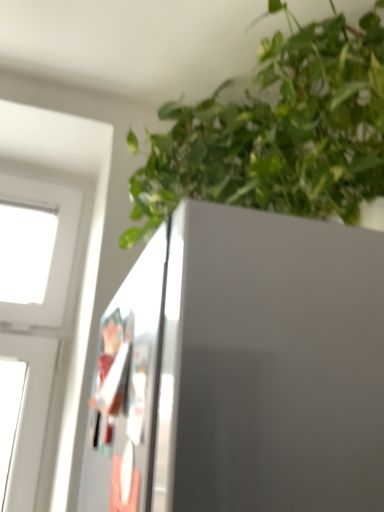
Question: Considering the positions of green leafy plant at upper right and transparent plastic screen door at left in the image, is green leafy plant at upper right bigger or smaller than transparent plastic screen door at left?

Choices:
 (A) small
 (B) big

Answer: (B)

Question: Which is correct: green leafy plant at upper right is inside transparent plastic screen door at left, or outside of it?

Choices:
 (A) inside
 (B) outside

Answer: (B)

Question: Looking at their shapes, would you say green leafy plant at upper right is wider or thinner than transparent plastic screen door at left?

Choices:
 (A) wide
 (B) thin

Answer: (A)

Question: Is transparent plastic screen door at left taller or shorter than green leafy plant at upper right?

Choices:
 (A) short
 (B) tall

Answer: (A)

Question: Would you say transparent plastic screen door at left is to the left or to the right of green leafy plant at upper right in the picture?

Choices:
 (A) right
 (B) left

Answer: (B)

Question: Do you think transparent plastic screen door at left is within green leafy plant at upper right, or outside of it?

Choices:
 (A) outside
 (B) inside

Answer: (A)

Question: From the image's perspective, relative to green leafy plant at upper right, is transparent plastic screen door at left above or below?

Choices:
 (A) above
 (B) below

Answer: (B)